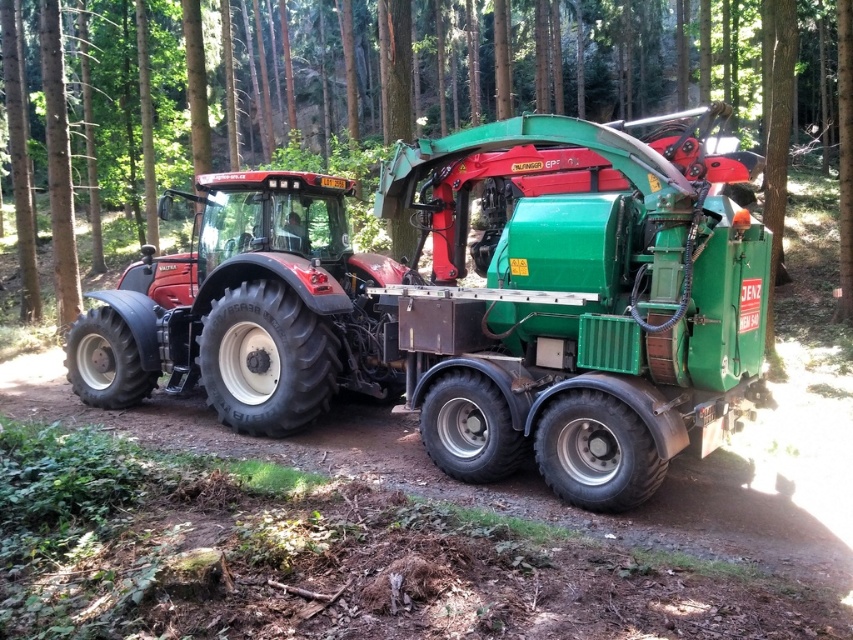
You are a maintenance worker needing to reach the green metallic truck at center from the matte black tractor at center. The safety protocol requires you to stay within 20 meters to avoid forest terrain hazards. Can you safely reach the truck without violating the protocol?

The distance between the matte black tractor at center and the green metallic truck at center is 21.24 meters, which exceeds the 20 meters safety protocol. Therefore, you cannot safely reach the truck without violating the protocol.

You are a farmer who needs to move the matte black tractor at center and the green metallic truck at center to a storage area. Based on their positions in the image, which one would you move first to avoid blocking the other?

The matte black tractor at center is located below the green metallic truck at center, so you should move the green metallic truck at center first to prevent blocking access to the matte black tractor at center.

You are standing at the viewpoint of the image and want to place a 2.5 meter long wooden board between yourself and the point at coordinates point (158, 328). Will the board reach that point?

The distance between the viewer and point (158, 328) is 7.13 meters. Since the board is only 2.5 meters long, it will not reach the point.